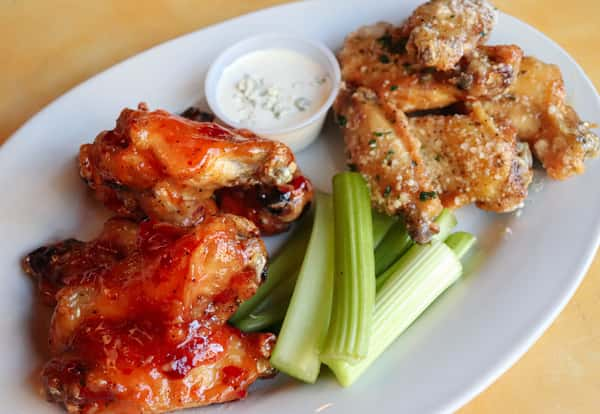
At what (x,y) coordinates should I click in order to perform the action: click on light brown wooden table. Please return your answer as a coordinate pair (x, y). This screenshot has height=414, width=600. Looking at the image, I should click on (545, 362).